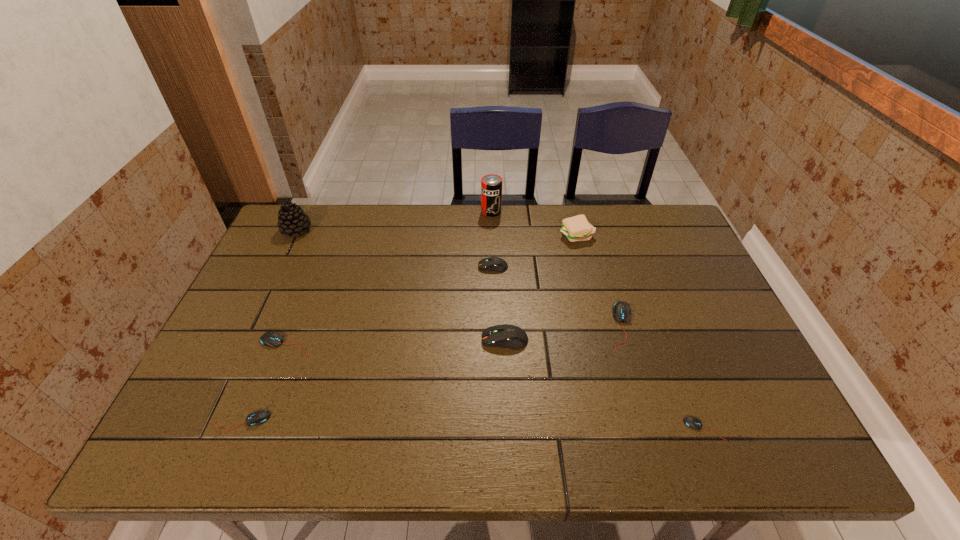
This screenshot has width=960, height=540. In order to click on the farthest object in this screenshot , I will do `click(491, 185)`.

Find the location of a particular element. The width and height of the screenshot is (960, 540). can is located at coordinates (491, 185).

This screenshot has width=960, height=540. I want to click on pinecone, so click(292, 220).

You are a GUI agent. You are given a task and a screenshot of the screen. Output one action in this format:
    pyautogui.click(x=<x>, y=<y>)
    Task: Click on the patty
    
    Given the screenshot: What is the action you would take?
    pyautogui.click(x=577, y=228)

Locate an element on the screen. the tallest mouse is located at coordinates (513, 337).

At what (x,y) coordinates should I click in order to perform the action: click on the sixth shortest object. Please return your answer as a coordinate pair (x, y). Looking at the image, I should click on (513, 337).

Image resolution: width=960 pixels, height=540 pixels. Identify the location of the fifth tallest object. (497, 264).

You are a GUI agent. You are given a task and a screenshot of the screen. Output one action in this format:
    pyautogui.click(x=<x>, y=<y>)
    Task: Click on the sixth nearest object
    Image resolution: width=960 pixels, height=540 pixels.
    Given the screenshot: What is the action you would take?
    pyautogui.click(x=497, y=264)

You are a GUI agent. You are given a task and a screenshot of the screen. Output one action in this format:
    pyautogui.click(x=<x>, y=<y>)
    Task: Click on the biggest black mouse
    
    Given the screenshot: What is the action you would take?
    pyautogui.click(x=621, y=311)

Locate an element on the screen. Image resolution: width=960 pixels, height=540 pixels. the second black mouse from right to left is located at coordinates (621, 311).